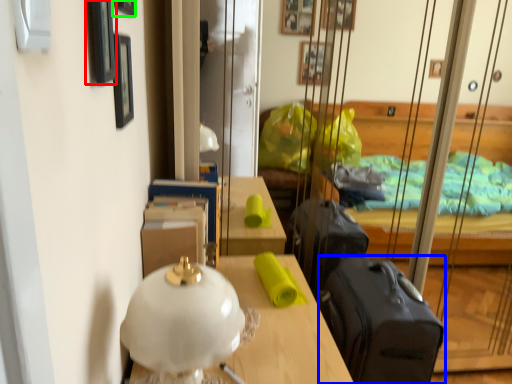
Question: Which object is positioned farthest from picture frame (highlighted by a red box)? Select from suitcase (highlighted by a blue box) and picture frame (highlighted by a green box).

Choices:
 (A) suitcase
 (B) picture frame

Answer: (A)